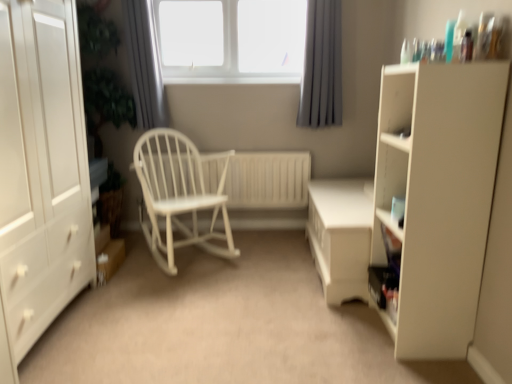
Find the location of `free location in front of white wood rocking chair at center`. free location in front of white wood rocking chair at center is located at coordinates (183, 301).